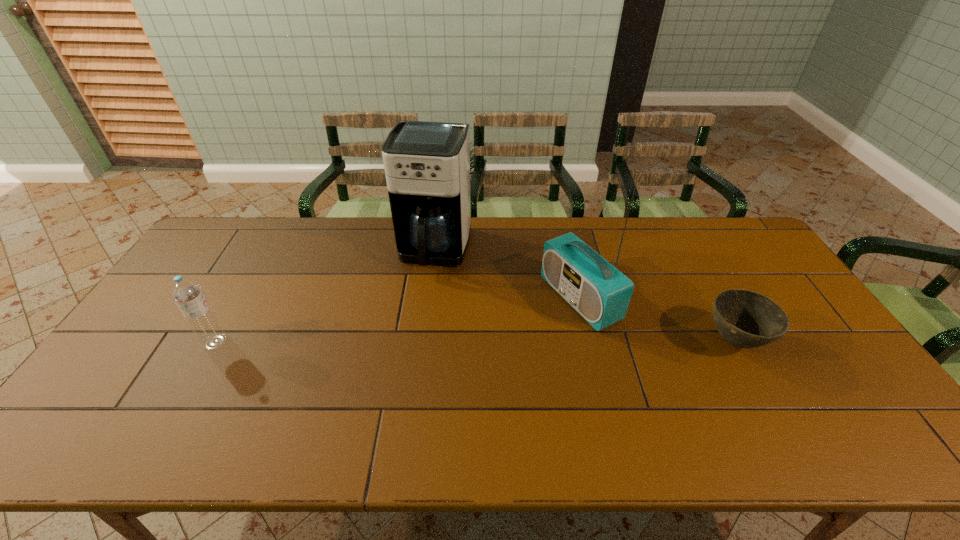
Locate an element on the screen. free spot on the desktop that is between the water bottle and the rightmost object and is positioned on the front panel of the radio receiver is located at coordinates (485, 341).

Where is `vacant space on the desktop that is between the water bottle and the rightmost object and is positioned on the front panel of the coffee maker`? Image resolution: width=960 pixels, height=540 pixels. vacant space on the desktop that is between the water bottle and the rightmost object and is positioned on the front panel of the coffee maker is located at coordinates (404, 341).